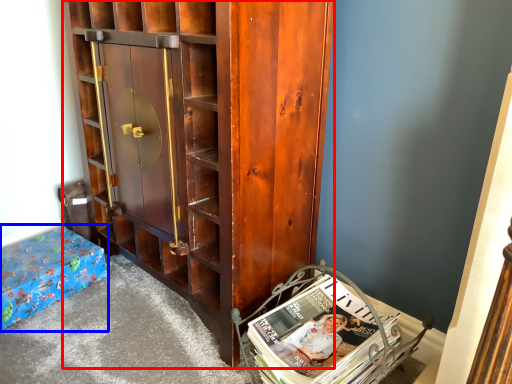
Question: Which point is further to the camera, cabinetry (highlighted by a red box) or furniture (highlighted by a blue box)?

Choices:
 (A) cabinetry
 (B) furniture

Answer: (B)